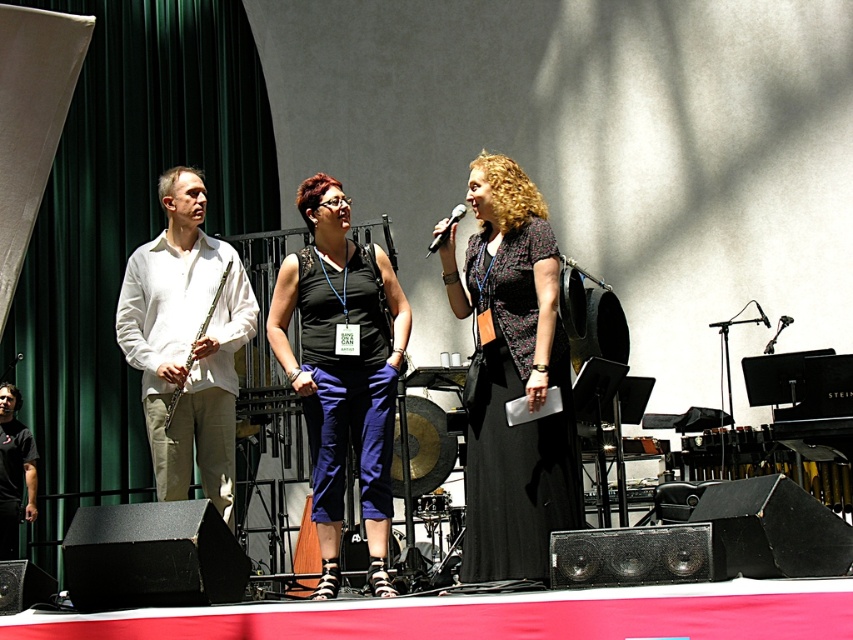
You are a photographer positioned at the back of the stage. You want to take a photo focusing on the black fabric dress at center and the black fabric shirt at left. Which one will appear larger in your photo?

The black fabric dress at center will appear larger in the photo because it is closer to the viewer than the black fabric shirt at left.

In the scene shown: You are a photographer at the event and want to capture a closeup of the black textured dress at center. According to the coordinates provided, where should you aim your camera?

The black textured dress at center is located at coordinates point (515,426), so you should aim your camera there to capture the closeup.